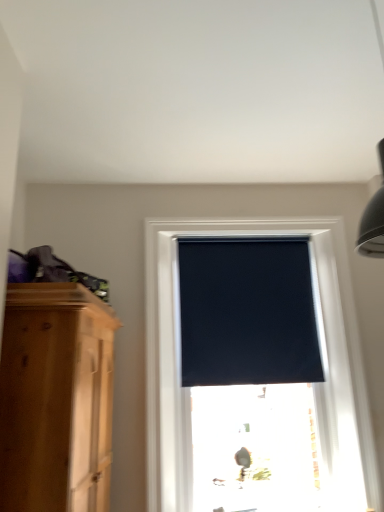
Question: Is the depth of black matte window blind at center greater than that of black matte window at center?

Choices:
 (A) yes
 (B) no

Answer: (A)

Question: Considering the relative sizes of black matte window blind at center and black matte window at center in the image provided, is black matte window blind at center smaller than black matte window at center?

Choices:
 (A) yes
 (B) no

Answer: (A)

Question: Is black matte window blind at center facing towards black matte window at center?

Choices:
 (A) no
 (B) yes

Answer: (B)

Question: Does black matte window blind at center appear on the left side of black matte window at center?

Choices:
 (A) no
 (B) yes

Answer: (B)

Question: Does black matte window blind at center have a greater width compared to black matte window at center?

Choices:
 (A) no
 (B) yes

Answer: (A)

Question: Would you say black matte window blind at center is a long distance from black matte window at center?

Choices:
 (A) yes
 (B) no

Answer: (B)

Question: From the image's perspective, is black matte window at center located beneath black matte window blind at center?

Choices:
 (A) yes
 (B) no

Answer: (A)

Question: Would you say black matte window at center is a long distance from black matte window blind at center?

Choices:
 (A) yes
 (B) no

Answer: (B)

Question: Is black matte window at center positioned with its back to black matte window blind at center?

Choices:
 (A) yes
 (B) no

Answer: (A)

Question: Does black matte window at center have a lesser width compared to black matte window blind at center?

Choices:
 (A) no
 (B) yes

Answer: (A)

Question: Considering the relative positions of black matte window at center and black matte window blind at center in the image provided, is black matte window at center to the right of black matte window blind at center from the viewer's perspective?

Choices:
 (A) yes
 (B) no

Answer: (A)

Question: Is black matte window at center not inside black matte window blind at center?

Choices:
 (A) no
 (B) yes

Answer: (B)

Question: Relative to black matte window blind at center, is black matte window at center in front or behind?

Choices:
 (A) front
 (B) behind

Answer: (A)